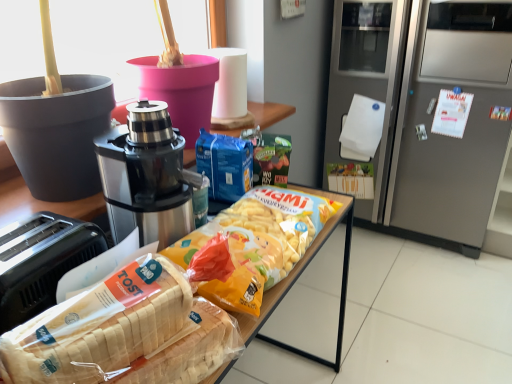
What do you see at coordinates (100, 326) in the screenshot? I see `white plastic bread at lower left` at bounding box center [100, 326].

Describe the element at coordinates (44, 205) in the screenshot. The width and height of the screenshot is (512, 384). I see `white glossy refrigerator at right` at that location.

Where is `satin silver refrigerator at right`? This screenshot has width=512, height=384. satin silver refrigerator at right is located at coordinates (452, 121).

You are a GUI agent. You are given a task and a screenshot of the screen. Output one action in this format:
    pyautogui.click(x=<x>, y=<y>)
    Task: Click on the white plastic bread at lower left
    This screenshot has width=512, height=384.
    Given the screenshot: What is the action you would take?
    pyautogui.click(x=100, y=326)

From a real-world perspective, is white glossy refrigerator at right physically located above or below satin silver refrigerator at right?

From a real-world perspective, white glossy refrigerator at right is physically above satin silver refrigerator at right.

Identify the location of home appliance below the white glossy refrigerator at right (from a real-world perspective). Image resolution: width=512 pixels, height=384 pixels. (452, 121).

Between white glossy refrigerator at right and satin silver refrigerator at right, which one appears on the left side from the viewer's perspective?

white glossy refrigerator at right.

Which object is further away from the camera taking this photo, white glossy refrigerator at right or satin silver refrigerator at right?

satin silver refrigerator at right is more distant.

Which is in front, white plastic bread at lower left or satin silver refrigerator at right?

white plastic bread at lower left is in front.

Identify the location of home appliance lying on the right of white plastic bread at lower left. (452, 121).

Does white plastic bread at lower left appear on the left side of satin silver refrigerator at right?

Correct, you'll find white plastic bread at lower left to the left of satin silver refrigerator at right.

Is white plastic bread at lower left touching satin silver refrigerator at right?

No.

From the image's perspective, which one is positioned higher, satin silver refrigerator at right or white glossy refrigerator at right?

From the image's view, satin silver refrigerator at right is above.

Between satin silver refrigerator at right and white glossy refrigerator at right, which one appears on the left side from the viewer's perspective?

Positioned to the left is white glossy refrigerator at right.

What's the angular difference between satin silver refrigerator at right and white glossy refrigerator at right's facing directions?

There is a 92.8-degree angle between the facing directions of satin silver refrigerator at right and white glossy refrigerator at right.

Is satin silver refrigerator at right bigger or smaller than white glossy refrigerator at right?

Considering their sizes, satin silver refrigerator at right takes up more space than white glossy refrigerator at right.

Would you say stainless steel coffee maker at center is inside or outside white glossy refrigerator at right?

stainless steel coffee maker at center fits inside white glossy refrigerator at right.

Is stainless steel coffee maker at center positioned far away from white glossy refrigerator at right?

No.

How many degrees apart are the facing directions of stainless steel coffee maker at center and white glossy refrigerator at right?

1.41 degrees.

Consider the image. Which of these two, stainless steel coffee maker at center or white glossy refrigerator at right, is wider?

Wider between the two is white glossy refrigerator at right.

Is white plastic bread at lower left not inside white glossy refrigerator at right?

Actually, white plastic bread at lower left is within white glossy refrigerator at right.

Considering the relative sizes of white plastic bread at lower left and white glossy refrigerator at right in the image provided, is white plastic bread at lower left bigger than white glossy refrigerator at right?

Actually, white plastic bread at lower left might be smaller than white glossy refrigerator at right.

The width and height of the screenshot is (512, 384). What are the coordinates of `cabinetry on the left of the white plastic bread at lower left` in the screenshot? It's located at (44, 205).

Does satin silver refrigerator at right touch stainless steel coffee maker at center?

satin silver refrigerator at right and stainless steel coffee maker at center are clearly separated.

Is stainless steel coffee maker at center at the back of satin silver refrigerator at right?

No.

Which object is further away from the camera taking this photo, satin silver refrigerator at right or stainless steel coffee maker at center?

Positioned behind is satin silver refrigerator at right.

From a real-world perspective, is satin silver refrigerator at right positioned under stainless steel coffee maker at center based on gravity?

Yes, from a real-world perspective, satin silver refrigerator at right is under stainless steel coffee maker at center.

Is stainless steel coffee maker at center positioned in front of satin silver refrigerator at right?

Yes, it is in front of satin silver refrigerator at right.

Is stainless steel coffee maker at center oriented away from satin silver refrigerator at right?

No, stainless steel coffee maker at center is not facing away from satin silver refrigerator at right.

Choose the correct answer: Is stainless steel coffee maker at center inside satin silver refrigerator at right or outside it?

stainless steel coffee maker at center lies outside satin silver refrigerator at right.

Considering the relative sizes of stainless steel coffee maker at center and satin silver refrigerator at right in the image provided, is stainless steel coffee maker at center smaller than satin silver refrigerator at right?

Indeed, stainless steel coffee maker at center has a smaller size compared to satin silver refrigerator at right.

At what (x,y) coordinates should I click in order to perform the action: click on cabinetry that is on the left side of satin silver refrigerator at right. Please return your answer as a coordinate pair (x, y). Looking at the image, I should click on (44, 205).

Image resolution: width=512 pixels, height=384 pixels. Identify the location of home appliance on the right of white plastic bread at lower left. (452, 121).

Considering their positions, is white plastic bread at lower left positioned closer to white glossy refrigerator at right than stainless steel coffee maker at center?

Among the two, stainless steel coffee maker at center is located nearer to white glossy refrigerator at right.

Which object lies nearer to the anchor point white glossy refrigerator at right, stainless steel coffee maker at center or white plastic bread at lower left?

stainless steel coffee maker at center is positioned closer to the anchor white glossy refrigerator at right.

Estimate the real-world distances between objects in this image. Which object is closer to white glossy refrigerator at right, satin silver refrigerator at right or stainless steel coffee maker at center?

stainless steel coffee maker at center.

Estimate the real-world distances between objects in this image. Which object is closer to white plastic bread at lower left, satin silver refrigerator at right or white glossy refrigerator at right?

Among the two, white glossy refrigerator at right is located nearer to white plastic bread at lower left.

Estimate the real-world distances between objects in this image. Which object is closer to white glossy refrigerator at right, satin silver refrigerator at right or white plastic bread at lower left?

white plastic bread at lower left lies closer to white glossy refrigerator at right than the other object.

When comparing their distances from stainless steel coffee maker at center, does satin silver refrigerator at right or white plastic bread at lower left seem further?

Among the two, satin silver refrigerator at right is located further to stainless steel coffee maker at center.

Which object lies further to the anchor point white plastic bread at lower left, stainless steel coffee maker at center or white glossy refrigerator at right?

The object further to white plastic bread at lower left is stainless steel coffee maker at center.

Which object lies further to the anchor point stainless steel coffee maker at center, white glossy refrigerator at right or satin silver refrigerator at right?

Among the two, satin silver refrigerator at right is located further to stainless steel coffee maker at center.

Locate an element on the screen. cereal between white glossy refrigerator at right and satin silver refrigerator at right from left to right is located at coordinates (100, 326).

The image size is (512, 384). I want to click on cereal positioned between white glossy refrigerator at right and stainless steel coffee maker at center from near to far, so click(x=100, y=326).

The width and height of the screenshot is (512, 384). What are the coordinates of `cereal located between stainless steel coffee maker at center and satin silver refrigerator at right in the left-right direction` in the screenshot? It's located at (100, 326).

You are a GUI agent. You are given a task and a screenshot of the screen. Output one action in this format:
    pyautogui.click(x=<x>, y=<y>)
    Task: Click on the coffee maker between white glossy refrigerator at right and satin silver refrigerator at right in the horizontal direction
    The image size is (512, 384).
    Given the screenshot: What is the action you would take?
    pyautogui.click(x=146, y=176)